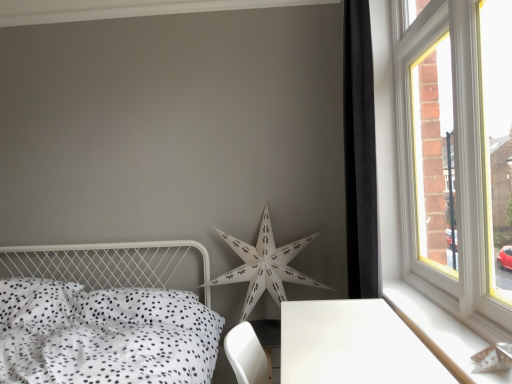
Measure the distance between white dotted fabric bed at lower left and camera.

white dotted fabric bed at lower left is 5.18 feet from camera.

This screenshot has width=512, height=384. Find the location of `white dotted fabric bed at lower left`. white dotted fabric bed at lower left is located at coordinates (104, 316).

Locate an element on the screen. The image size is (512, 384). white glossy table at lower right is located at coordinates (353, 345).

The image size is (512, 384). I want to click on white paper star at center, so click(x=264, y=266).

Identify the location of black velvet curtain at right. The image size is (512, 384). (360, 152).

Is white dotted fabric bed at lower left inside black velvet curtain at right?

No, white dotted fabric bed at lower left is located outside of black velvet curtain at right.

Does black velvet curtain at right have a larger size compared to white dotted fabric bed at lower left?

Incorrect, black velvet curtain at right is not larger than white dotted fabric bed at lower left.

From the picture: Considering the relative sizes of black velvet curtain at right and white dotted fabric bed at lower left in the image provided, is black velvet curtain at right wider than white dotted fabric bed at lower left?

No.

From a real-world perspective, is white dotted fabric bed at lower left below white plastic window at right?

Yes, from a real-world perspective, white dotted fabric bed at lower left is under white plastic window at right.

Considering the sizes of white dotted fabric bed at lower left and white plastic window at right in the image, is white dotted fabric bed at lower left wider or thinner than white plastic window at right?

Considering their sizes, white dotted fabric bed at lower left looks broader than white plastic window at right.

Consider the image. From the image's perspective, between white dotted fabric bed at lower left and white plastic window at right, who is located below?

white dotted fabric bed at lower left is shown below in the image.

Is white dotted fabric bed at lower left inside or outside of white plastic window at right?

white dotted fabric bed at lower left is not inside white plastic window at right, it's outside.

Which object is wider, white glossy table at lower right or white paper star at center?

white glossy table at lower right is wider.

Is white glossy table at lower right looking in the opposite direction of white paper star at center?

white glossy table at lower right is not turned away from white paper star at center.

There is a white glossy table at lower right. Identify the location of star above it (from a real-world perspective). (264, 266).

Consider the image. Is white dotted fabric bed at lower left positioned with its back to white wood at right?

No, white dotted fabric bed at lower left's orientation is not away from white wood at right.

This screenshot has width=512, height=384. Find the location of `bed located on the left of white wood at right`. bed located on the left of white wood at right is located at coordinates (104, 316).

Is white dotted fabric bed at lower left in contact with white wood at right?

No, white dotted fabric bed at lower left is not next to white wood at right.

Considering the relative sizes of white dotted fabric bed at lower left and white wood at right in the image provided, is white dotted fabric bed at lower left smaller than white wood at right?

No.

From a real-world perspective, is white wood at right positioned above or below white glossy table at lower right?

Clearly, from a real-world perspective, white wood at right is above white glossy table at lower right.

Is white wood at right aimed at white glossy table at lower right?

Yes, white wood at right is facing white glossy table at lower right.

Does white wood at right come behind white glossy table at lower right?

No.

Considering their positions, is white plastic window at right located in front of or behind white glossy table at lower right?

In the image, white plastic window at right appears behind white glossy table at lower right.

Considering the relative sizes of white plastic window at right and white glossy table at lower right in the image provided, is white plastic window at right thinner than white glossy table at lower right?

Yes.

Considering the sizes of white plastic window at right and white glossy table at lower right in the image, is white plastic window at right bigger or smaller than white glossy table at lower right?

In the image, white plastic window at right appears to be smaller than white glossy table at lower right.

The image size is (512, 384). I want to click on window that is behind the white glossy table at lower right, so click(x=456, y=165).

From a real-world perspective, which is physically below, white plastic window at right or white dotted fabric bed at lower left?

white dotted fabric bed at lower left, from a real-world perspective.

Could you tell me if white plastic window at right is facing white dotted fabric bed at lower left?

Yes, white plastic window at right faces towards white dotted fabric bed at lower left.

Where is `curtain located behind the white dotted fabric bed at lower left`? Image resolution: width=512 pixels, height=384 pixels. curtain located behind the white dotted fabric bed at lower left is located at coordinates (360, 152).

This screenshot has width=512, height=384. Find the location of `window on the right of white dotted fabric bed at lower left`. window on the right of white dotted fabric bed at lower left is located at coordinates (456, 165).

Based on their spatial positions, is white plastic window at right or white wood at right further from white dotted fabric bed at lower left?

The object further to white dotted fabric bed at lower left is white plastic window at right.

Based on their spatial positions, is white dotted fabric bed at lower left or white plastic window at right further from white paper star at center?

The object further to white paper star at center is white plastic window at right.

Looking at the image, which one is located closer to white glossy table at lower right, white paper star at center or white dotted fabric bed at lower left?

white dotted fabric bed at lower left.

When comparing their distances from white plastic window at right, does white glossy table at lower right or white paper star at center seem closer?

white glossy table at lower right lies closer to white plastic window at right than the other object.

Based on their spatial positions, is white glossy table at lower right or white wood at right further from white dotted fabric bed at lower left?

white wood at right is positioned further to the anchor white dotted fabric bed at lower left.

From the image, which object appears to be nearer to white dotted fabric bed at lower left, white paper star at center or black velvet curtain at right?

white paper star at center.

Looking at the image, which one is located closer to white plastic window at right, white wood at right or white dotted fabric bed at lower left?

Among the two, white wood at right is located nearer to white plastic window at right.

Based on their spatial positions, is black velvet curtain at right or white plastic window at right closer to white dotted fabric bed at lower left?

Based on the image, black velvet curtain at right appears to be nearer to white dotted fabric bed at lower left.

Find the location of a particular element. This screenshot has width=512, height=384. curtain located between white dotted fabric bed at lower left and white wood at right in the left-right direction is located at coordinates (360, 152).

You are a GUI agent. You are given a task and a screenshot of the screen. Output one action in this format:
    pyautogui.click(x=<x>, y=<y>)
    Task: Click on the window sill situated between white dotted fabric bed at lower left and white plastic window at right from left to right
    The width and height of the screenshot is (512, 384).
    Given the screenshot: What is the action you would take?
    pyautogui.click(x=443, y=330)

Where is `table between white dotted fabric bed at lower left and black velvet curtain at right from left to right`? The width and height of the screenshot is (512, 384). table between white dotted fabric bed at lower left and black velvet curtain at right from left to right is located at coordinates (353, 345).

Image resolution: width=512 pixels, height=384 pixels. What are the coordinates of `curtain between white glossy table at lower right and white paper star at center from front to back` in the screenshot? It's located at (360, 152).